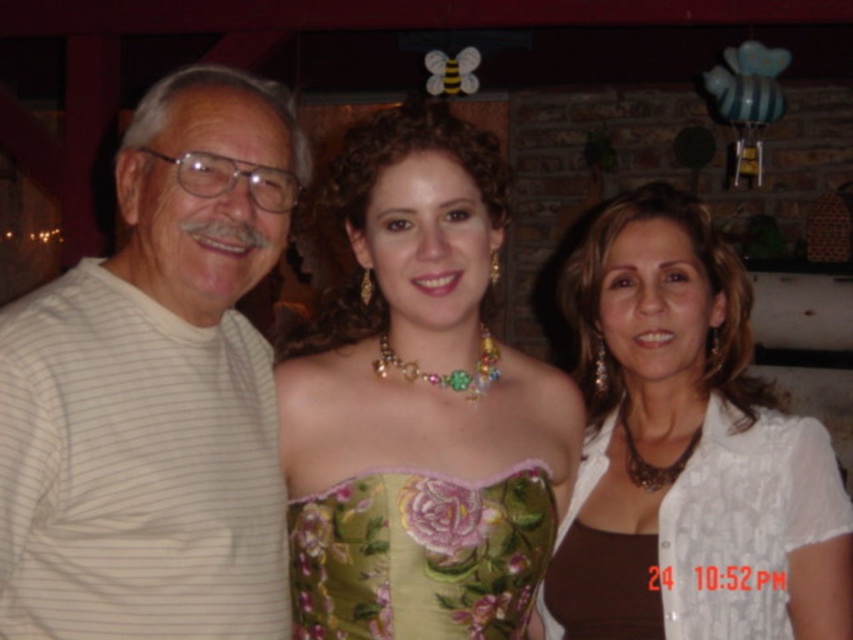
Can you confirm if white striped shirt at left is smaller than green floral fabric dress at center?

Actually, white striped shirt at left might be larger than green floral fabric dress at center.

You are a GUI agent. You are given a task and a screenshot of the screen. Output one action in this format:
    pyautogui.click(x=<x>, y=<y>)
    Task: Click on the white striped shirt at left
    The width and height of the screenshot is (853, 640).
    Given the screenshot: What is the action you would take?
    pyautogui.click(x=155, y=390)

Does point (305, 422) come closer to viewer compared to point (689, 273)?

Yes, point (305, 422) is closer to viewer.

Can you confirm if green floral dress at center is wider than white lace blouse at center?

Yes.

Between point (558, 410) and point (831, 513), which one is positioned in front?

Point (831, 513) is in front.

The image size is (853, 640). I want to click on green floral dress at center, so click(x=419, y=404).

The height and width of the screenshot is (640, 853). In order to click on white striped shirt at left in this screenshot , I will do `click(155, 390)`.

Is point (113, 348) closer to viewer compared to point (799, 467)?

Yes, it is in front of point (799, 467).

Between point (177, 609) and point (741, 422), which one is positioned in front?

Point (177, 609) is in front.

This screenshot has height=640, width=853. In order to click on white striped shirt at left in this screenshot , I will do `click(155, 390)`.